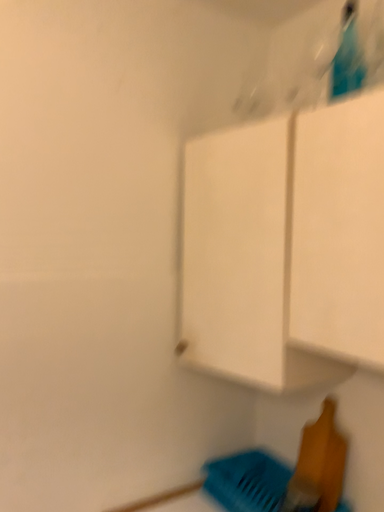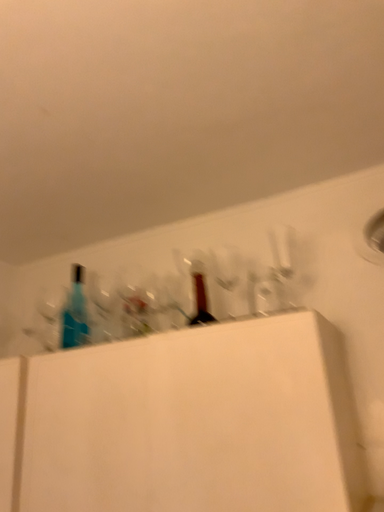
Question: Which way did the camera rotate in the video?

Choices:
 (A) rotated left
 (B) rotated right

Answer: (B)